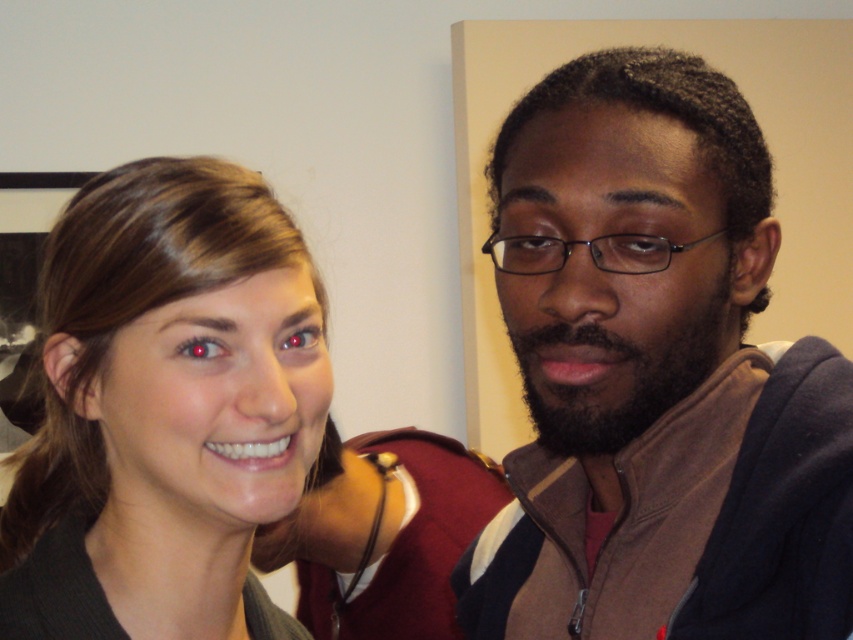
Question: Does brown fleece jacket at right have a greater width compared to smooth skin face at center?

Choices:
 (A) no
 (B) yes

Answer: (A)

Question: Which object appears closest to the camera in this image?

Choices:
 (A) brown fleece jacket at right
 (B) smooth skin face at center

Answer: (A)

Question: Observing the image, what is the correct spatial positioning of brown fleece jacket at right in reference to smooth skin face at center?

Choices:
 (A) right
 (B) left

Answer: (A)

Question: Which point is closer to the camera?

Choices:
 (A) (709, 513)
 (B) (228, 456)

Answer: (B)

Question: Is brown fleece jacket at right to the left of smooth skin face at center from the viewer's perspective?

Choices:
 (A) no
 (B) yes

Answer: (A)

Question: Which of the following is the closest to the observer?

Choices:
 (A) smooth skin face at center
 (B) brown fleece jacket at right

Answer: (B)